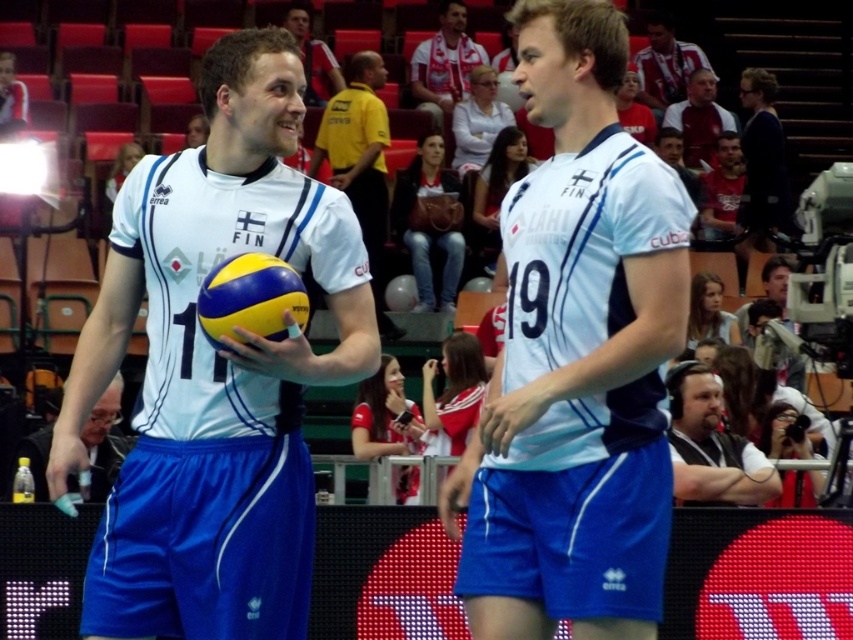
Can you confirm if white jersey at upper right is positioned to the right of matte black jersey at center?

Correct, you'll find white jersey at upper right to the right of matte black jersey at center.

Can you confirm if white jersey at upper right is bigger than matte black jersey at center?

Correct, white jersey at upper right is larger in size than matte black jersey at center.

This screenshot has height=640, width=853. Describe the element at coordinates (666, 65) in the screenshot. I see `white jersey at upper right` at that location.

Identify the location of white jersey at upper right. (666, 65).

Can you confirm if white jersey at upper right is taller than matte white jersey at center?

Indeed, white jersey at upper right has a greater height compared to matte white jersey at center.

Is white jersey at upper right below matte white jersey at center?

Indeed, white jersey at upper right is positioned under matte white jersey at center.

Is point (698, 51) positioned after point (331, 76)?

Yes.

At what (x,y) coordinates should I click in order to perform the action: click on white jersey at upper right. Please return your answer as a coordinate pair (x, y). The image size is (853, 640). Looking at the image, I should click on (666, 65).

Is yellowleather-likevolleyball at center in front of matte white jersey at center?

Yes, yellowleather-likevolleyball at center is in front of matte white jersey at center.

Is yellowleather-likevolleyball at center above matte white jersey at center?

No, yellowleather-likevolleyball at center is not above matte white jersey at center.

Is point (212, 284) positioned in front of point (329, 88)?

Yes, it is.

At what (x,y) coordinates should I click in order to perform the action: click on yellowleather-likevolleyball at center. Please return your answer as a coordinate pair (x, y). This screenshot has width=853, height=640. Looking at the image, I should click on (250, 298).